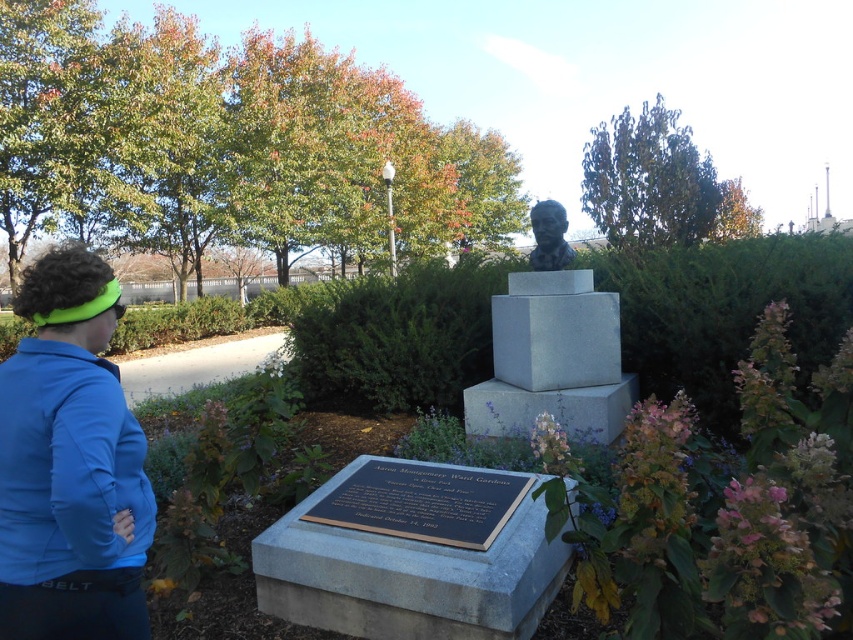
You are standing in the memorial area and need to locate two specific points marked on a map. The first point is at coordinates point (36, 356), and the second is at point (563, 225). According to the image, which point is closer to you?

Point (36, 356) is in front of point (563, 225), so the first point is closer to you.

In the scene shown: You are standing in front of the memorial area and want to locate the gray stone bust at center. According to the coordinates provided, where would you find it?

The gray stone bust at center is located at coordinates point (407, 332).